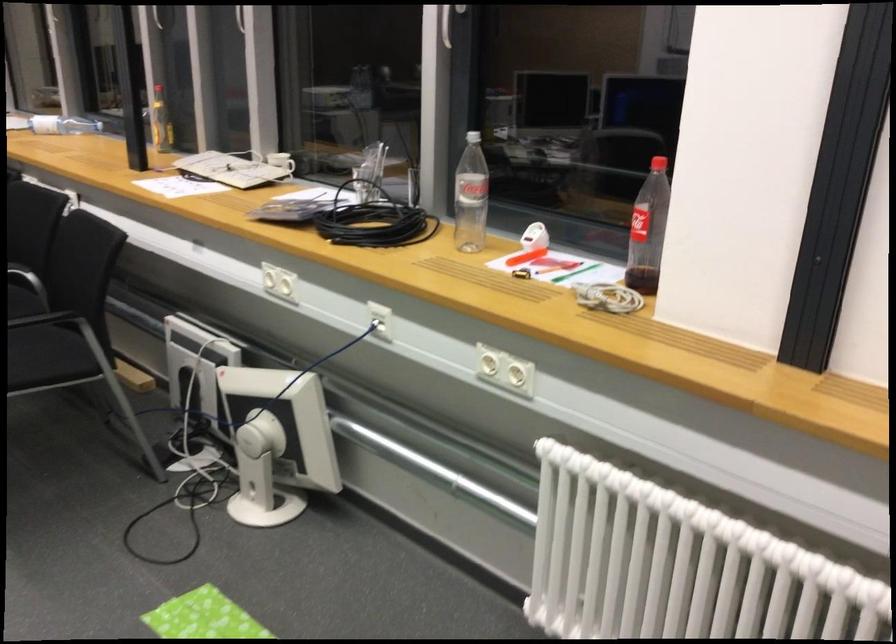
Identify the location of small white monitor. Image resolution: width=896 pixels, height=644 pixels. (277, 442).